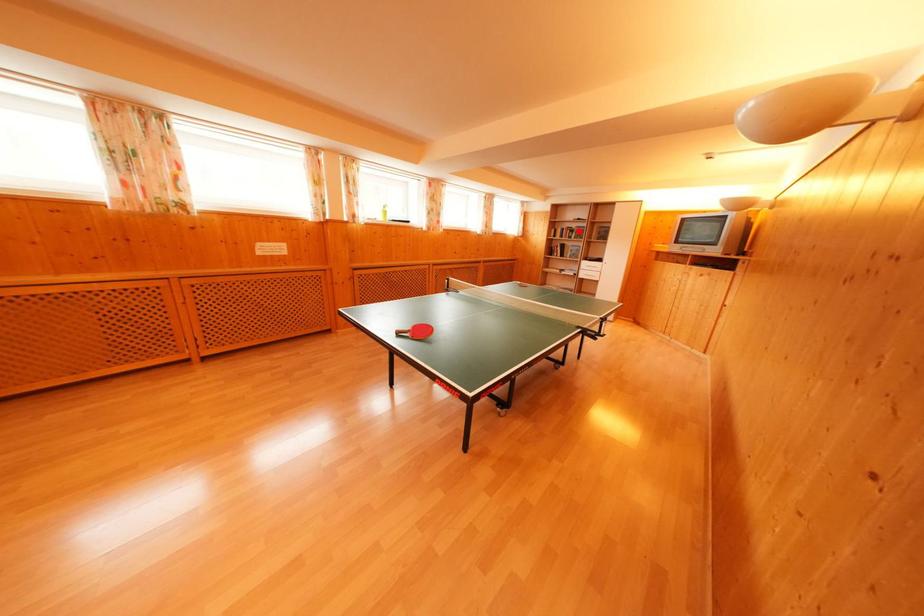
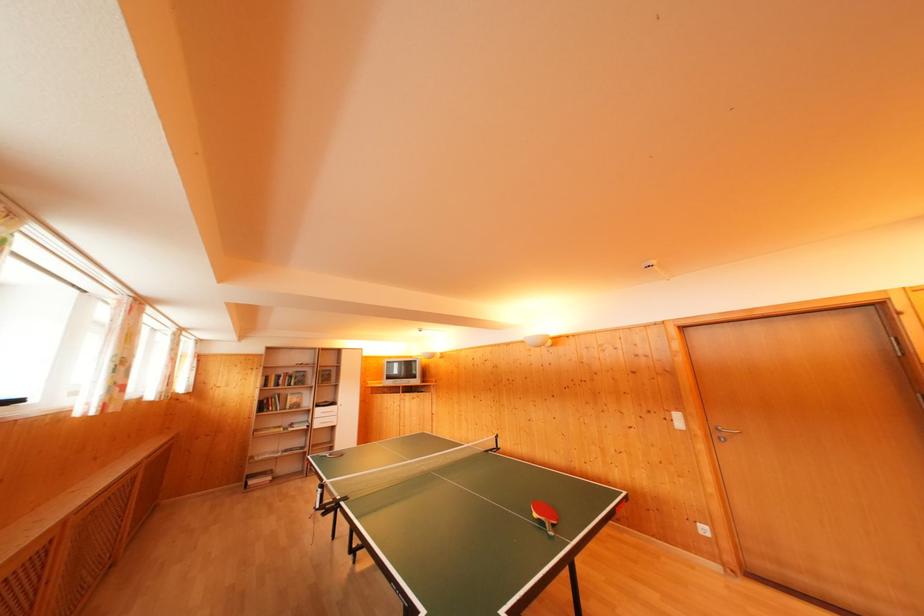
Question: I am providing you with two images of the same scene from different viewpoints. Given a red point in image1, look at the same physical point in image2. Is it:

Choices:
 (A) Closer to the viewpoint
 (B) Farther from the viewpoint

Answer: (B)